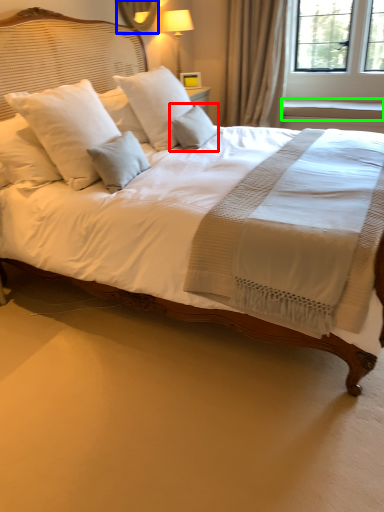
Question: Based on their relative distances, which object is nearer to pillow (highlighted by a red box)? Choose from mirror (highlighted by a blue box) and window sill (highlighted by a green box).

Choices:
 (A) mirror
 (B) window sill

Answer: (A)